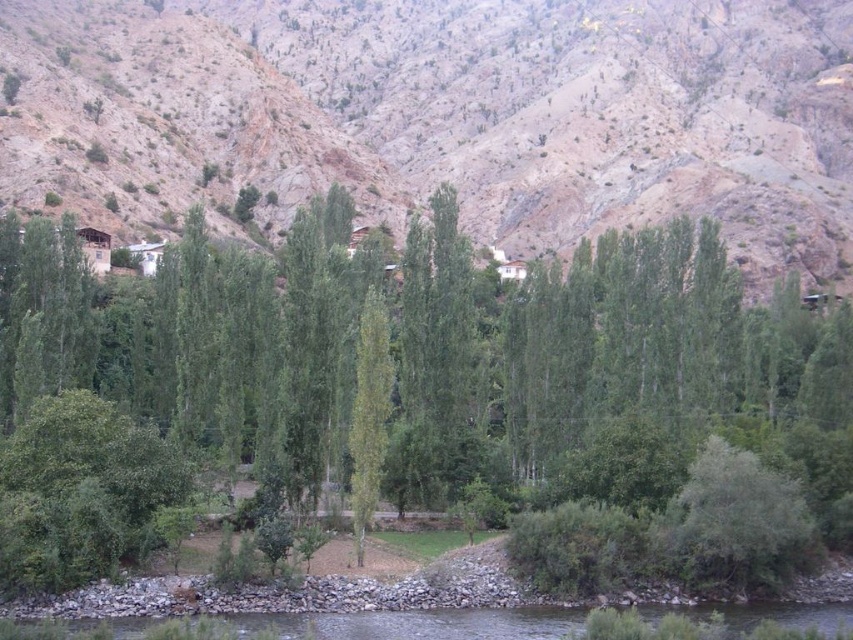
You are standing at the camera position and want to throw a stone to hit the dull brown rock at upper center. If your throwing range is 120 meters, will you be able to reach it?

The dull brown rock at upper center and camera are 123.65 meters apart from each other. Since your throwing range is 120 meters, you cannot reach the dull brown rock at upper center as it is beyond your maximum range.